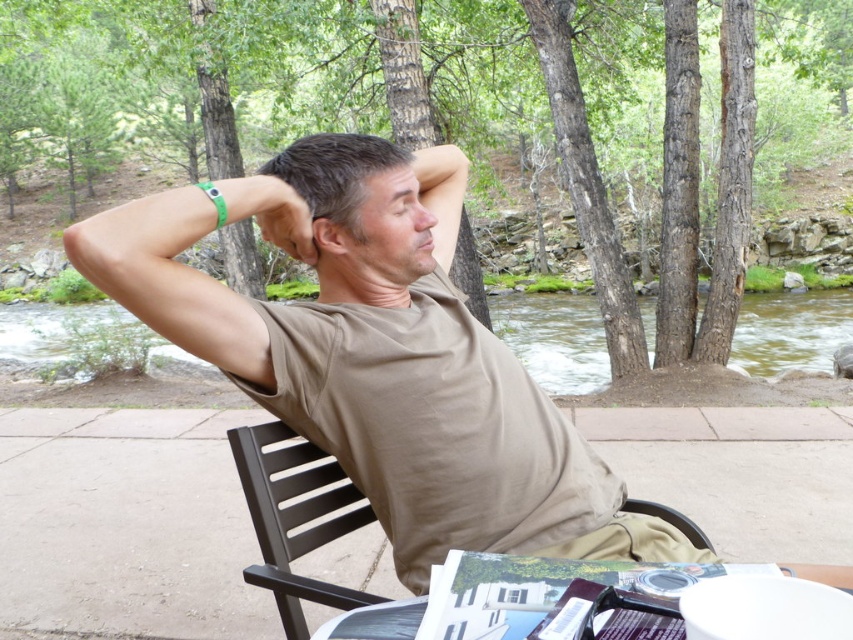
Question: Does tan cotton shirt at center appear on the left side of white paper at lower center?

Choices:
 (A) no
 (B) yes

Answer: (B)

Question: Is the position of brown matte hair at center less distant than that of matte green wristband at upper center?

Choices:
 (A) yes
 (B) no

Answer: (B)

Question: Is tan cotton shirt at center positioned before white paper at lower center?

Choices:
 (A) no
 (B) yes

Answer: (A)

Question: Which object is closer to the camera taking this photo?

Choices:
 (A) brown plastic chair at center
 (B) tan cotton shirt at center

Answer: (A)

Question: Considering the real-world distances, which object is closest to the brown plastic chair at center?

Choices:
 (A) white paper at lower center
 (B) brown matte hair at center
 (C) tan cotton shirt at center
 (D) matte green wristband at upper center

Answer: (A)

Question: Which point appears farthest from the camera in this image?

Choices:
 (A) (329, 508)
 (B) (299, 241)

Answer: (A)